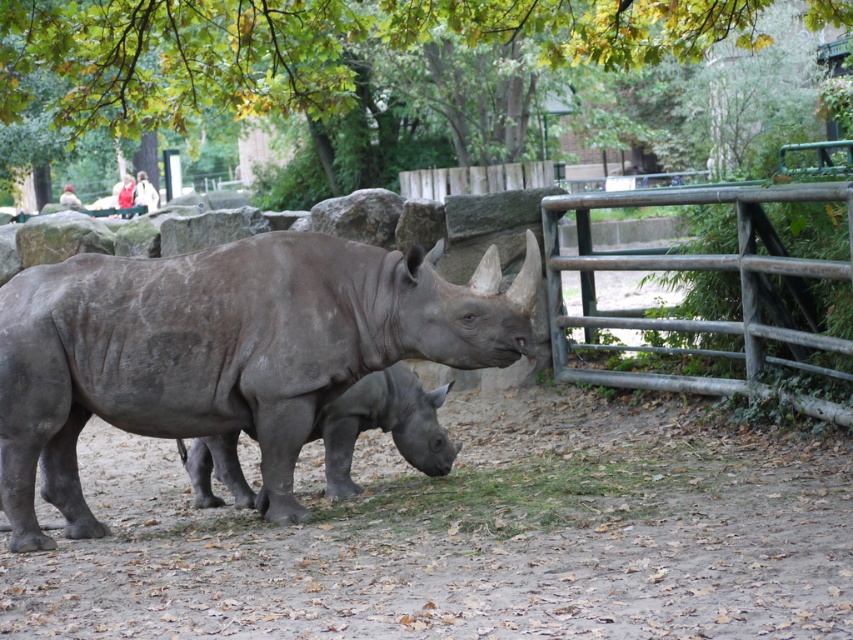
Question: Is gray matte rhinoceros at center to the right of green bamboo fence at right from the viewer's perspective?

Choices:
 (A) yes
 (B) no

Answer: (B)

Question: Which point is farther from the camera taking this photo?

Choices:
 (A) (604, 35)
 (B) (293, 262)
 (C) (117, 198)
 (D) (773, 264)

Answer: (C)

Question: Which of the following is the farthest from the observer?

Choices:
 (A) green leafy tree at upper center
 (B) green bamboo fence at right
 (C) white cotton jacket at upper left
 (D) gray matte rhino at center

Answer: (C)

Question: Where is green leafy tree at upper center located in relation to gray matte rhino at center in the image?

Choices:
 (A) left
 (B) right

Answer: (B)

Question: Is gray matte rhinoceros at center wider than white cotton jacket at upper left?

Choices:
 (A) no
 (B) yes

Answer: (B)

Question: Among these objects, which one is farthest from the camera?

Choices:
 (A) gray matte rhinoceros at center
 (B) white cotton jacket at upper left
 (C) green leafy tree at upper center
 (D) green bamboo fence at right

Answer: (B)